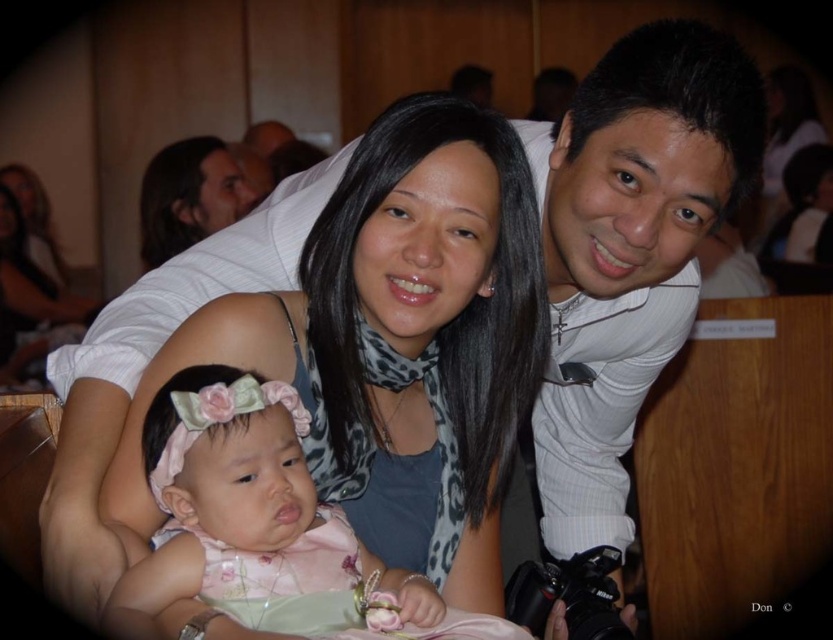
Question: Can you confirm if matte gray scarf at center is wider than matte black scarf at upper center?

Choices:
 (A) no
 (B) yes

Answer: (B)

Question: Which object is closer to the camera taking this photo?

Choices:
 (A) matte gray scarf at center
 (B) matte black scarf at upper center
 (C) pink satin dress at center

Answer: (C)

Question: Does matte gray scarf at center have a smaller size compared to matte black scarf at upper center?

Choices:
 (A) yes
 (B) no

Answer: (A)

Question: Which object is positioned farthest from the matte gray scarf at center?

Choices:
 (A) pink satin dress at center
 (B) matte black scarf at upper center

Answer: (B)

Question: Which point is farther from the camera taking this photo?

Choices:
 (A) (263, 451)
 (B) (148, 506)
 (C) (157, 216)

Answer: (C)

Question: Is pink satin dress at center in front of matte black scarf at upper center?

Choices:
 (A) no
 (B) yes

Answer: (B)